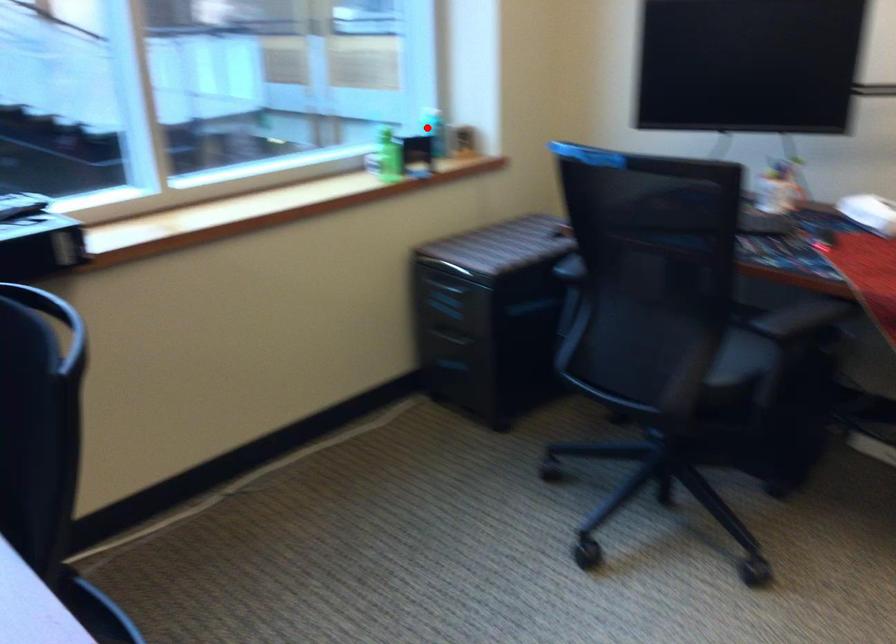
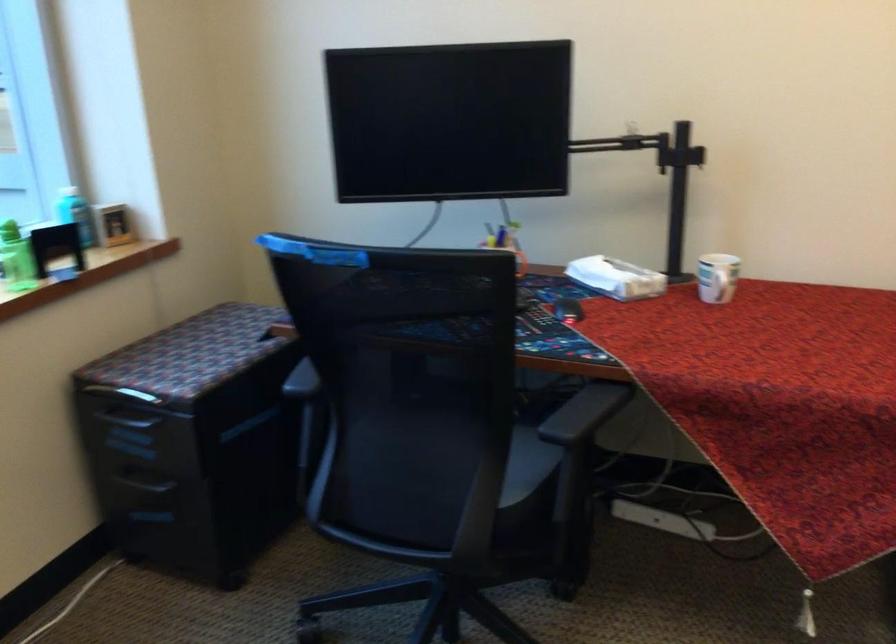
Find the pixel in the second image that matches the highlighted location in the first image.

(74, 214)